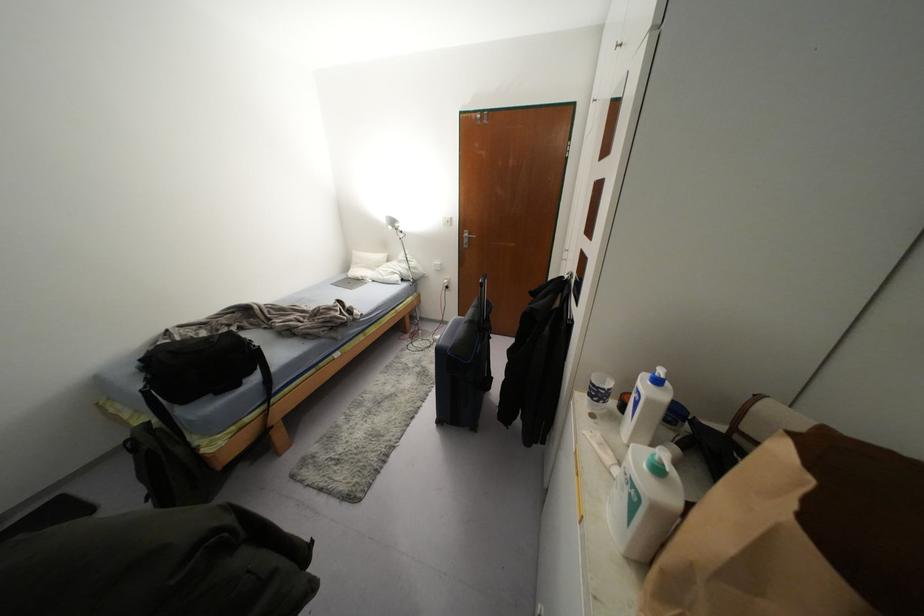
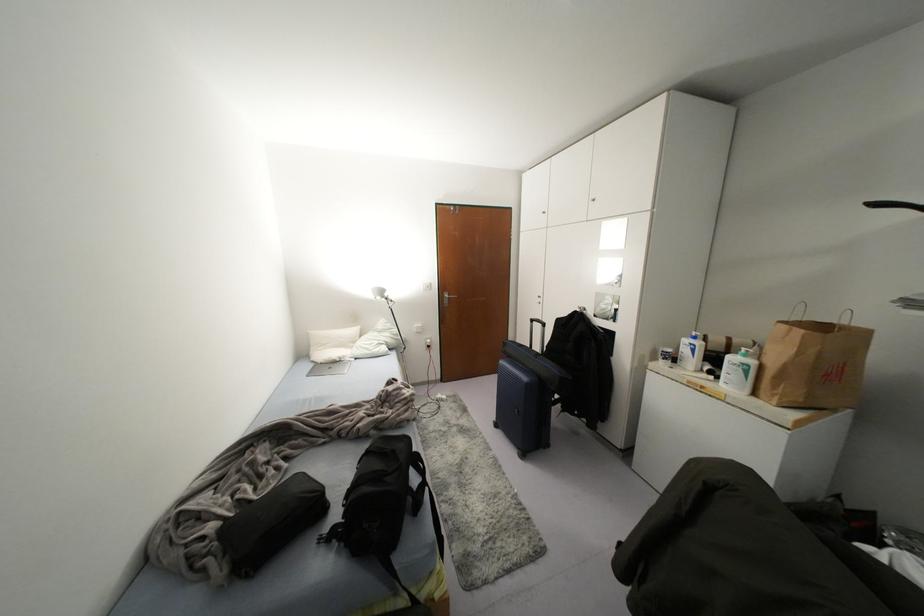
The point at [395,225] is marked in the first image. Where is the corresponding point in the second image?

(385, 294)